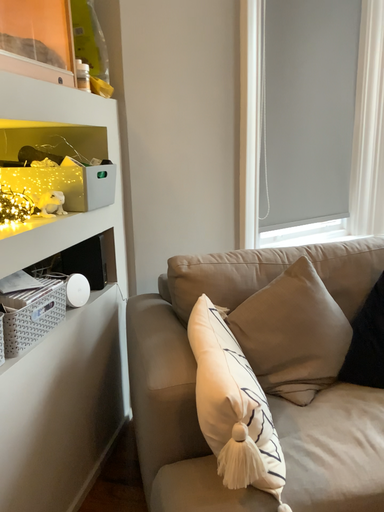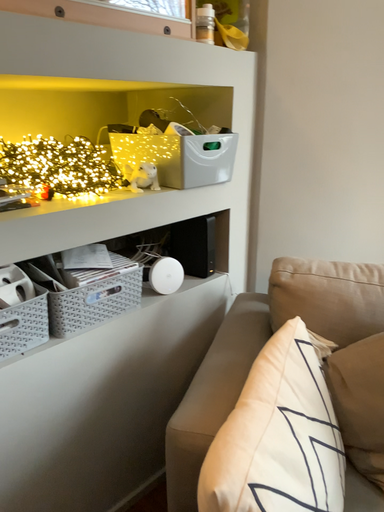
Question: Which way did the camera rotate in the video?

Choices:
 (A) rotated left
 (B) rotated right

Answer: (A)